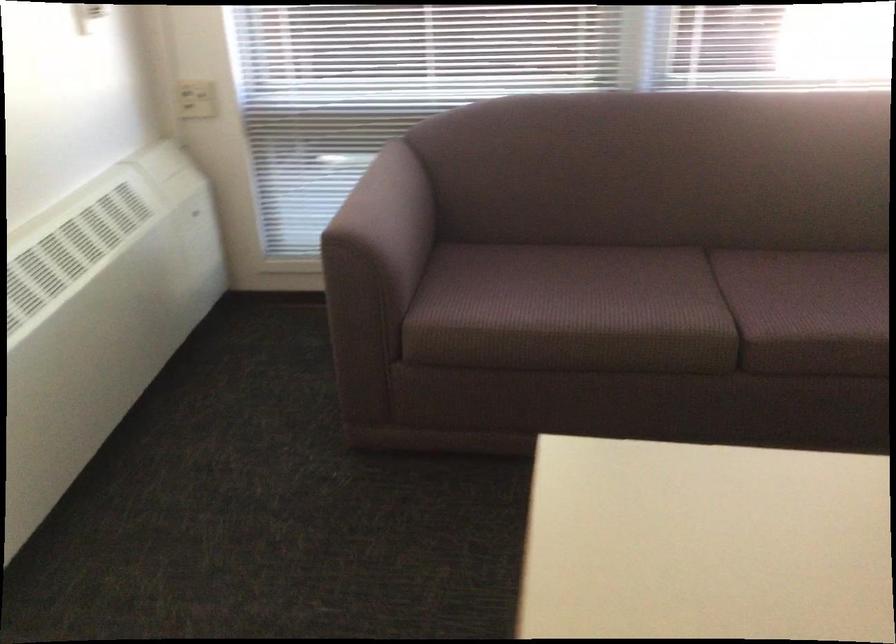
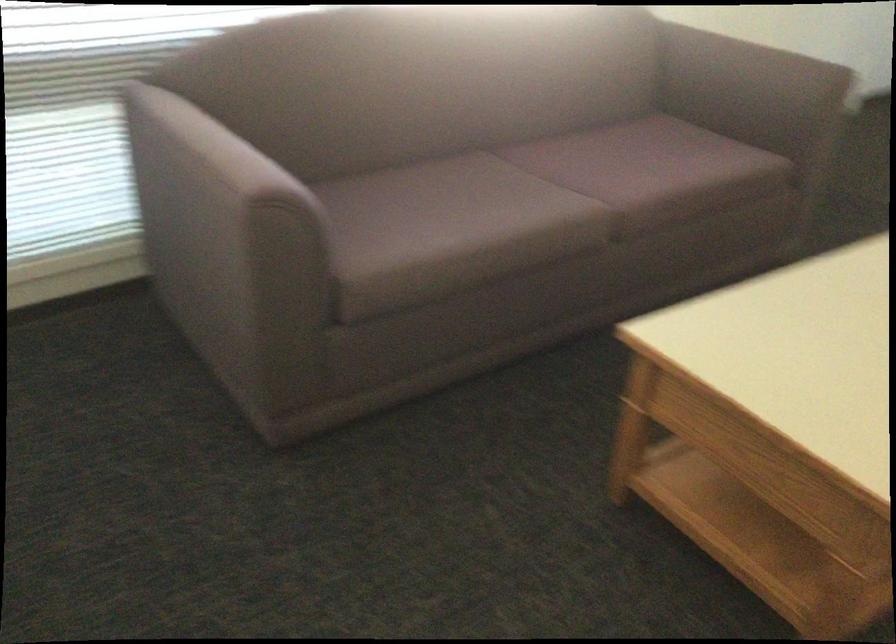
Locate, in the second image, the point that corresponds to [640,308] in the first image.

(528, 205)